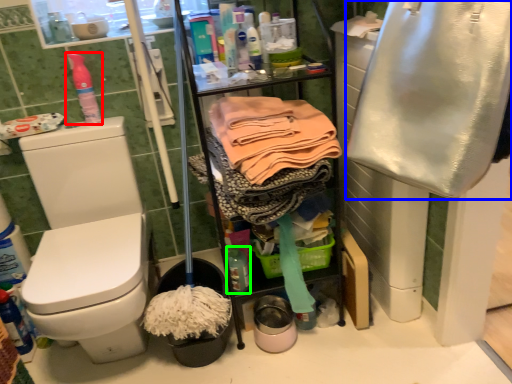
Question: Which object is positioned farthest from cleaning product (highlighted by a red box)? Select from clothing (highlighted by a blue box) and bottle (highlighted by a green box).

Choices:
 (A) clothing
 (B) bottle

Answer: (A)